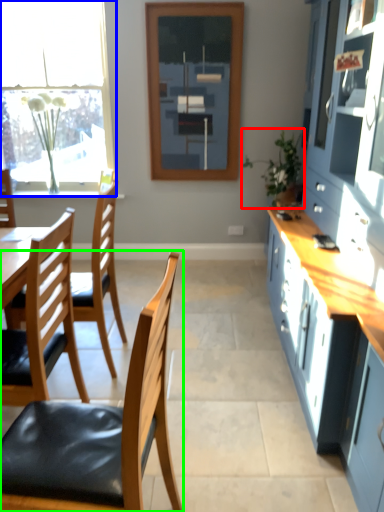
Question: Considering the real-world distances, which object is closest to houseplant (highlighted by a red box)? window (highlighted by a blue box) or chair (highlighted by a green box).

Choices:
 (A) window
 (B) chair

Answer: (A)